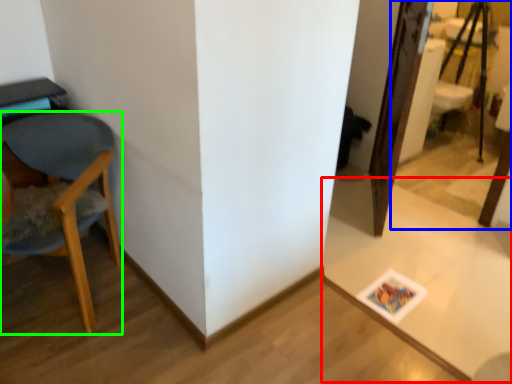
Question: Considering the real-world distances, which object is farthest from table (highlighted by a red box)? mirror (highlighted by a blue box) or chair (highlighted by a green box)?

Choices:
 (A) mirror
 (B) chair

Answer: (A)